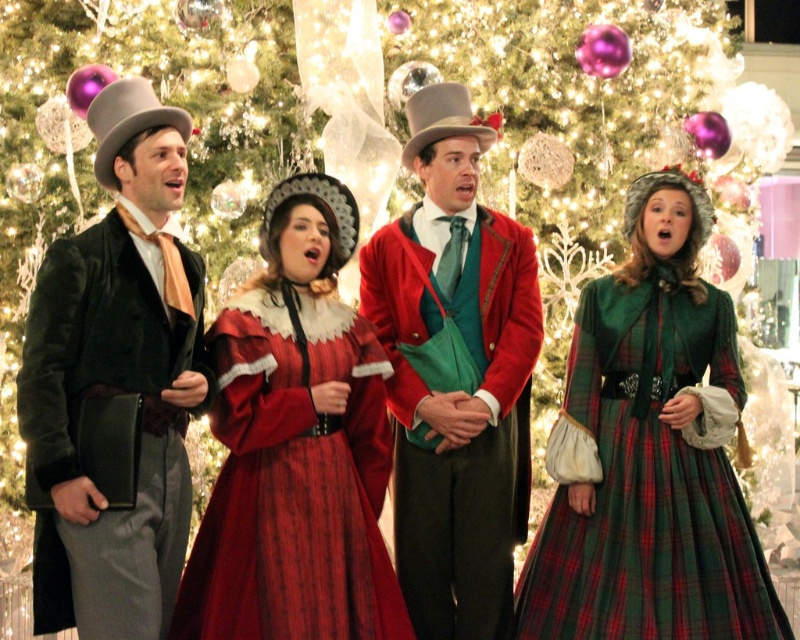
In the scene shown: Who is more distant from viewer, (266, 260) or (348, 227)?

The point (348, 227) is more distant.

Does velvet red dress at center have a greater width compared to felt dress hat at center?

Yes.

Is point (272, 592) positioned before point (348, 225)?

That is True.

Image resolution: width=800 pixels, height=640 pixels. Find the location of `velvet red dress at center`. velvet red dress at center is located at coordinates coord(296,445).

Is matte gray dress hat at center to the right of fuzzy fur dress hat at upper right from the viewer's perspective?

Incorrect, matte gray dress hat at center is not on the right side of fuzzy fur dress hat at upper right.

How much distance is there between matte gray dress hat at center and fuzzy fur dress hat at upper right?

matte gray dress hat at center and fuzzy fur dress hat at upper right are 14.01 meters apart from each other.

Is point (420, 138) closer to camera compared to point (694, 227)?

Yes, point (420, 138) is closer to viewer.

At what (x,y) coordinates should I click in order to perform the action: click on matte gray dress hat at center. Please return your answer as a coordinate pair (x, y). Image resolution: width=800 pixels, height=640 pixels. Looking at the image, I should click on tap(444, 120).

Based on the photo, measure the distance between point (197, 326) and camera.

Point (197, 326) is 181.64 feet from camera.

Describe the element at coordinates (114, 381) in the screenshot. I see `velvet black coat at left` at that location.

Is point (117, 214) farther from camera compared to point (474, 134)?

No, (117, 214) is in front of (474, 134).

At what (x,y) coordinates should I click in order to perform the action: click on velvet black coat at left. Please return your answer as a coordinate pair (x, y). Looking at the image, I should click on (114, 381).